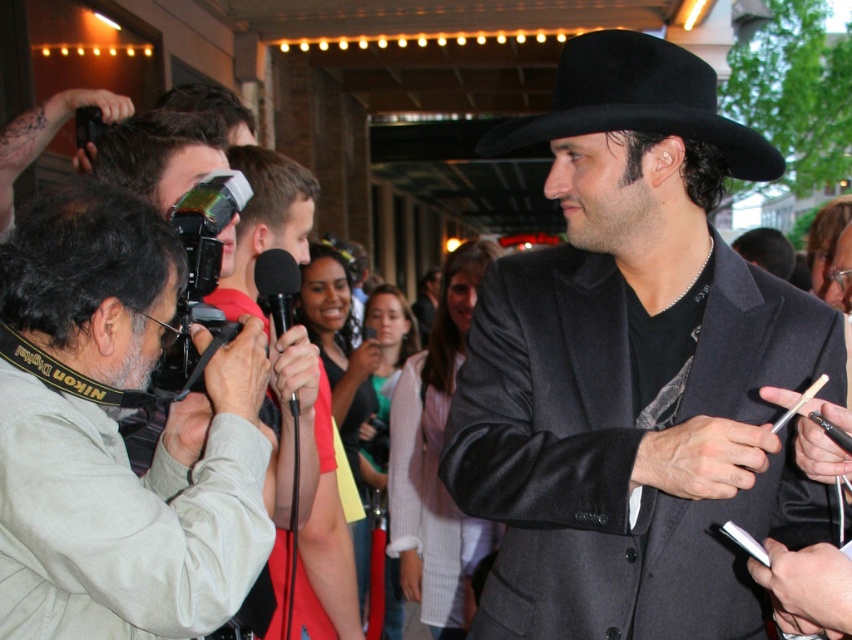
From the picture: Can you confirm if gray fabric camera at left is wider than black plastic video camera at left?

Indeed, gray fabric camera at left has a greater width compared to black plastic video camera at left.

Does point (200, 460) come behind point (206, 228)?

That is False.

Identify the location of gray fabric camera at left. (117, 435).

Does gray fabric camera at left have a greater width compared to red shirt at center?

Yes.

Between gray fabric camera at left and red shirt at center, which one appears on the right side from the viewer's perspective?

Positioned to the right is red shirt at center.

Does point (153, 480) come closer to viewer compared to point (275, 547)?

Yes, it is.

Identify the location of gray fabric camera at left. (117, 435).

Based on the photo, can you confirm if shiny black suit at center is wider than black felt fedora at upper center?

Correct, the width of shiny black suit at center exceeds that of black felt fedora at upper center.

Describe the element at coordinates (632, 368) in the screenshot. Image resolution: width=852 pixels, height=640 pixels. I see `shiny black suit at center` at that location.

You are a GUI agent. You are given a task and a screenshot of the screen. Output one action in this format:
    pyautogui.click(x=<x>, y=<y>)
    Task: Click on the shiny black suit at center
    
    Given the screenshot: What is the action you would take?
    632,368